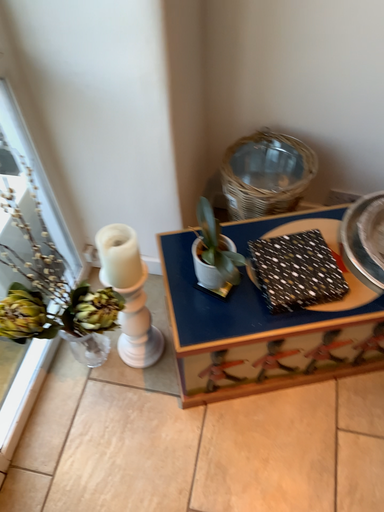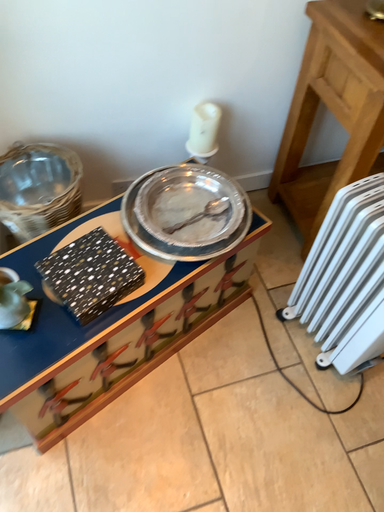
Question: Which way did the camera rotate in the video?

Choices:
 (A) rotated left
 (B) rotated right

Answer: (B)